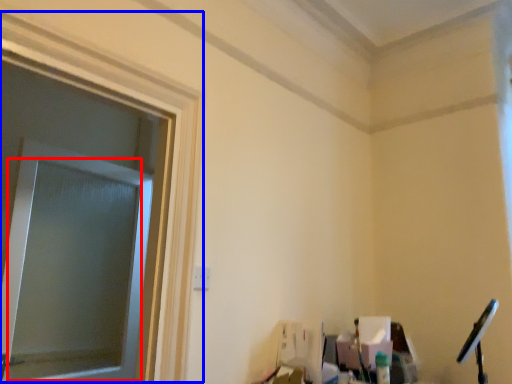
Question: Among these objects, which one is nearest to the camera, window screen (highlighted by a red box) or window frame (highlighted by a blue box)?

Choices:
 (A) window screen
 (B) window frame

Answer: (B)